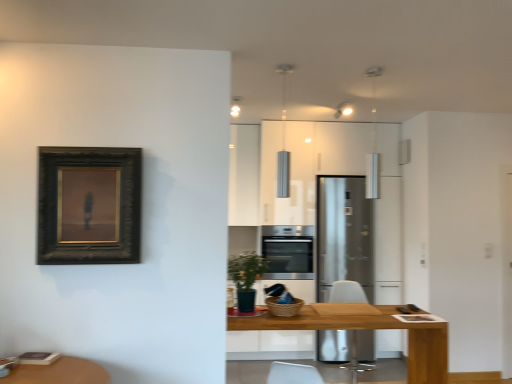
Image resolution: width=512 pixels, height=384 pixels. I want to click on free space above dark wood frame at upper left (from a real-world perspective), so click(90, 147).